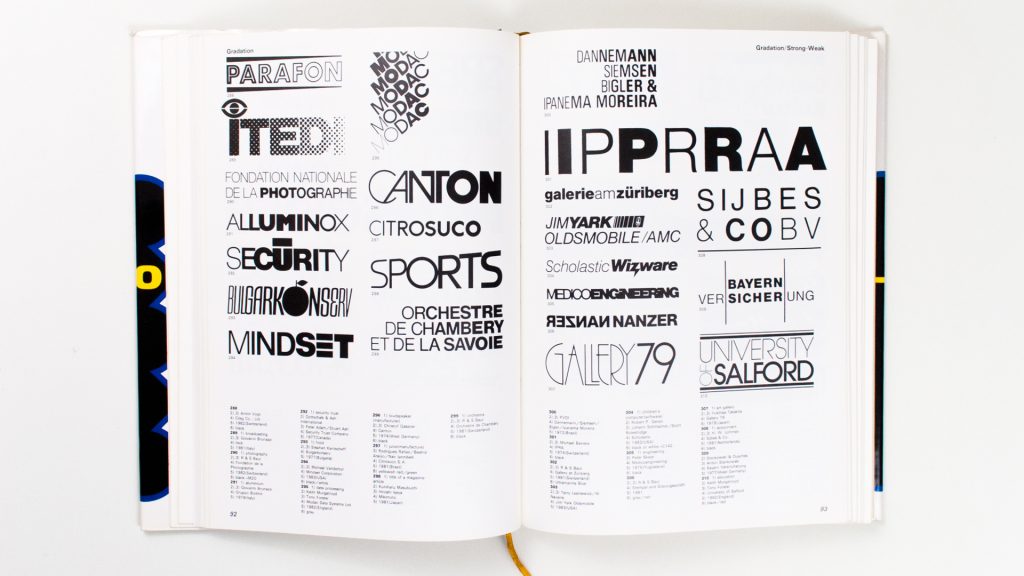
You are a GUI agent. You are given a task and a screenshot of the screen. Output one action in this format:
    pyautogui.click(x=<x>, y=<y>)
    Task: Click on the book backing
    Image resolution: width=1024 pixels, height=576 pixels.
    Given the screenshot: What is the action you would take?
    pyautogui.click(x=145, y=357), pyautogui.click(x=877, y=338)